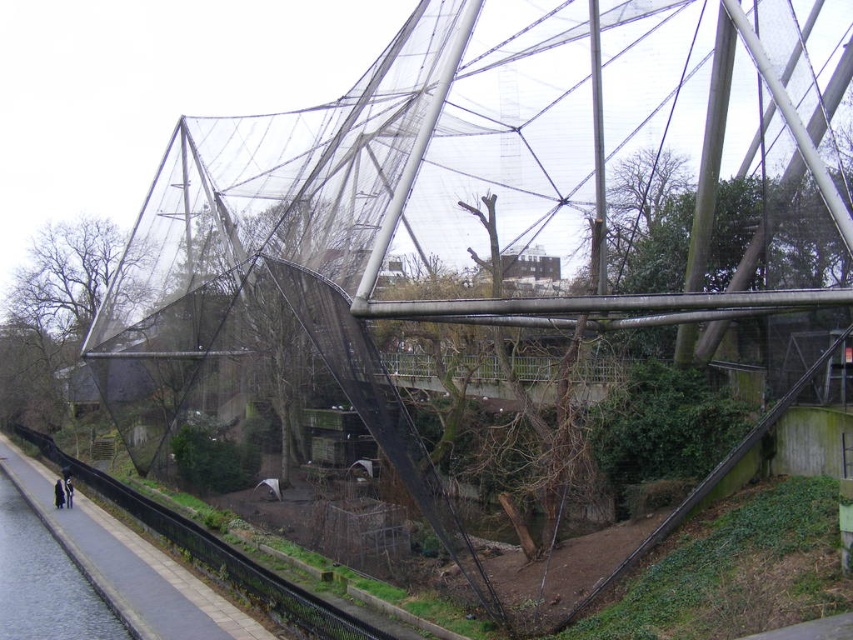
You are a maintenance worker needing to place a 2 meter by 2 meter equipment on the concrete sidewalk at lower left or the smooth gray water at lower left. Which location can accommodate the equipment based on their sizes?

The concrete sidewalk at lower left has a larger size compared to the smooth gray water at lower left, so the equipment can be placed on the concrete sidewalk at lower left.

You are a maintenance worker needing to access the dark blue fabric at lower left for repairs. There is a concrete sidewalk at lower left nearby. Which direction should you move from the sidewalk to reach the fabric?

You should move to the left from the concrete sidewalk at lower left to reach the dark blue fabric at lower left because the sidewalk is to the right of the fabric.